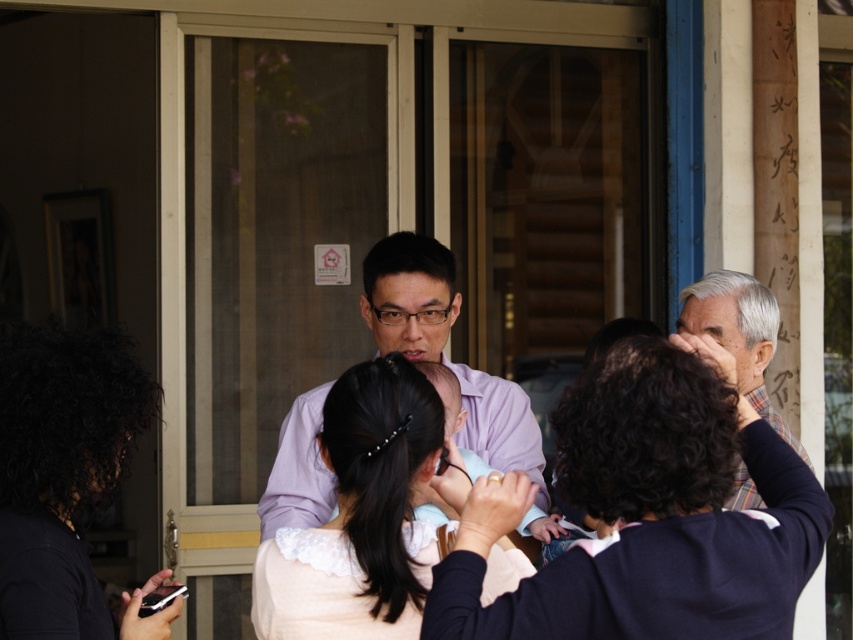
Question: Which point is farther from the camera taking this photo?

Choices:
 (A) (410, 515)
 (B) (569, 456)
 (C) (117, 385)

Answer: (C)

Question: Which object appears closest to the camera in this image?

Choices:
 (A) dark brown hair at center
 (B) black matte hair at lower left

Answer: (A)

Question: Can you confirm if black matte hair at lower left is smaller than light pink fabric at center?

Choices:
 (A) yes
 (B) no

Answer: (B)

Question: Is dark brown hair at center thinner than light pink fabric at center?

Choices:
 (A) no
 (B) yes

Answer: (A)

Question: Which of these objects is positioned closest to the dark brown hair at center?

Choices:
 (A) light pink fabric at center
 (B) black matte hair at lower left
 (C) matte purple shirt at center

Answer: (A)

Question: Is light pink fabric at center smaller than matte purple shirt at center?

Choices:
 (A) yes
 (B) no

Answer: (A)